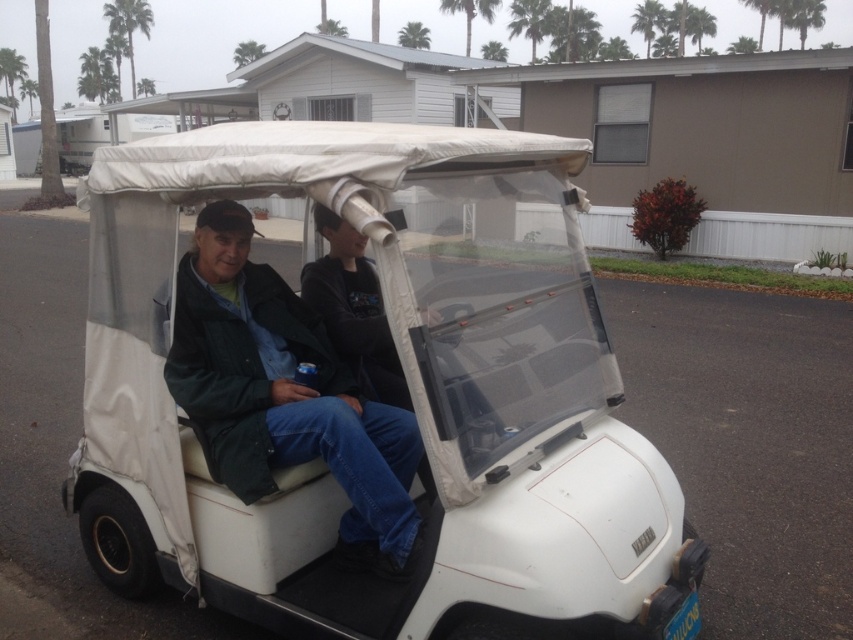
Is dark green jacket at center thinner than green leafy palm tree at upper left?

Yes.

Does dark green jacket at center appear on the left side of green leafy palm tree at upper left?

Incorrect, dark green jacket at center is not on the left side of green leafy palm tree at upper left.

Where is `dark green jacket at center`? This screenshot has height=640, width=853. dark green jacket at center is located at coordinates (285, 396).

In order to click on dark green jacket at center in this screenshot , I will do `click(285, 396)`.

Does white matte golf cart at center lie in front of dark green jacket at center?

That is True.

Who is more forward, (x=488, y=548) or (x=221, y=317)?

Positioned in front is point (x=488, y=548).

Find the location of a particular element. The width and height of the screenshot is (853, 640). white matte golf cart at center is located at coordinates (367, 397).

Between dark gray fabric jacket at center and green leafy palm tree at upper left, which one has less height?

dark gray fabric jacket at center

Can you confirm if dark gray fabric jacket at center is shorter than green leafy palm tree at upper left?

Indeed, dark gray fabric jacket at center has a lesser height compared to green leafy palm tree at upper left.

Where is `dark gray fabric jacket at center`? dark gray fabric jacket at center is located at coordinates (352, 308).